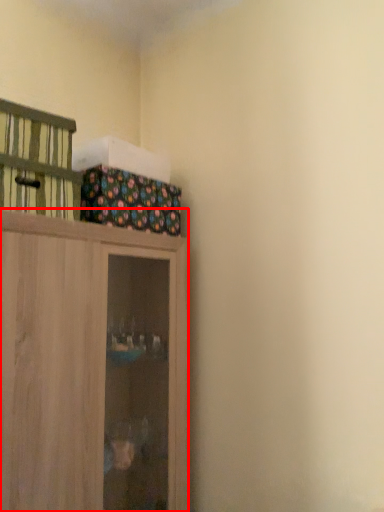
Question: From the image's perspective, what is the correct spatial positioning of cupboard (annotated by the red box) in reference to cabinetry?

Choices:
 (A) above
 (B) below

Answer: (B)